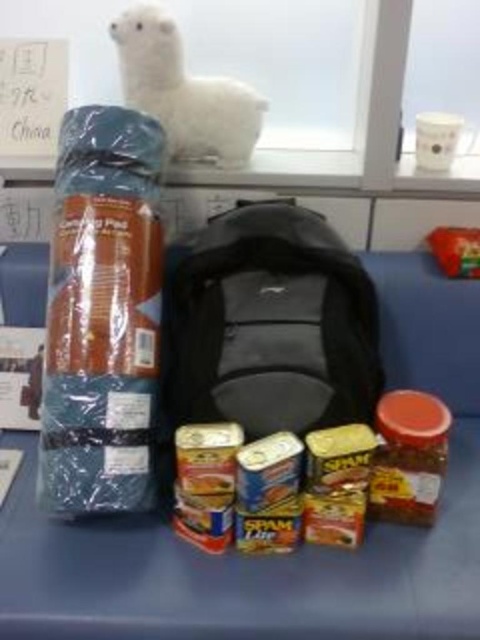
You are organizing items on a desk and need to place the black fabric backpack at center and the white plush at upper center. Which item takes up more vertical space?

The black fabric backpack at center is much taller as white plush at upper center, so it takes up more vertical space.

Looking at this image, what is located at the coordinates point (x=268, y=324)?

The black fabric backpack at center is located at point (x=268, y=324).

You are organizing items on a shelf and need to place the black fabric backpack at center and the white plush at upper center. Which item requires more horizontal space on the shelf?

The black fabric backpack at center requires more horizontal space because its width is larger than the white plush at upper center.